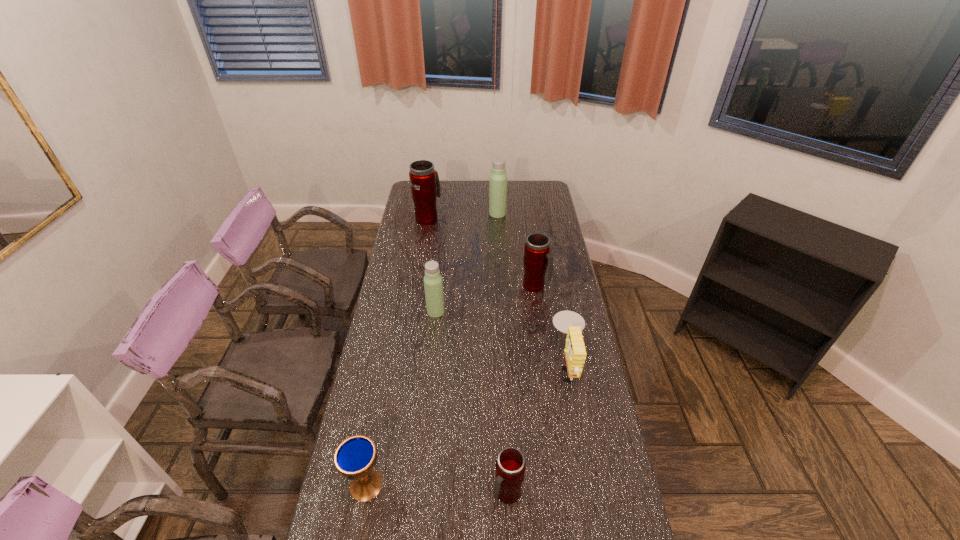
Identify which red thermos bottle is the third nearest to the yellow sponge. Please provide its 2D coordinates. Your answer should be formatted as a tuple, i.e. [(x, y)], where the tuple contains the x and y coordinates of a point satisfying the conditions above.

[(425, 186)]

Select which red thermos bottle appears as the second closest to the fourth farthest thermos bottle. Please provide its 2D coordinates. Your answer should be formatted as a tuple, i.e. [(x, y)], where the tuple contains the x and y coordinates of a point satisfying the conditions above.

[(425, 186)]

Select which light thermos bottle appears as the closest to the nearest red thermos bottle. Please provide its 2D coordinates. Your answer should be formatted as a tuple, i.e. [(x, y)], where the tuple contains the x and y coordinates of a point satisfying the conditions above.

[(433, 284)]

Where is `light thermos bottle object that ranks as the closest to the farthest red thermos bottle`? The height and width of the screenshot is (540, 960). light thermos bottle object that ranks as the closest to the farthest red thermos bottle is located at coordinates (498, 178).

Identify the location of vacant space that satisfies the following two spatial constraints: 1. on the front-facing side of the sponge; 2. on the side with the handle of the shortest thermos bottle. coord(591,494).